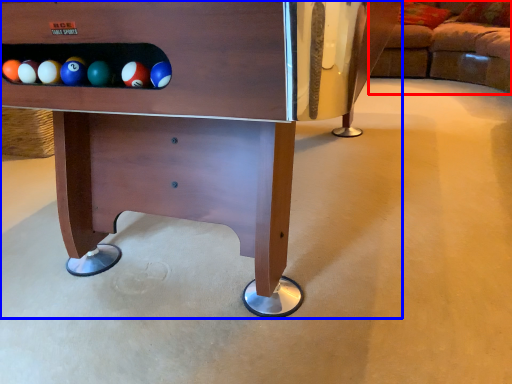
Question: Which point is closer to the camera, studio couch (highlighted by a red box) or furniture (highlighted by a blue box)?

Choices:
 (A) studio couch
 (B) furniture

Answer: (B)